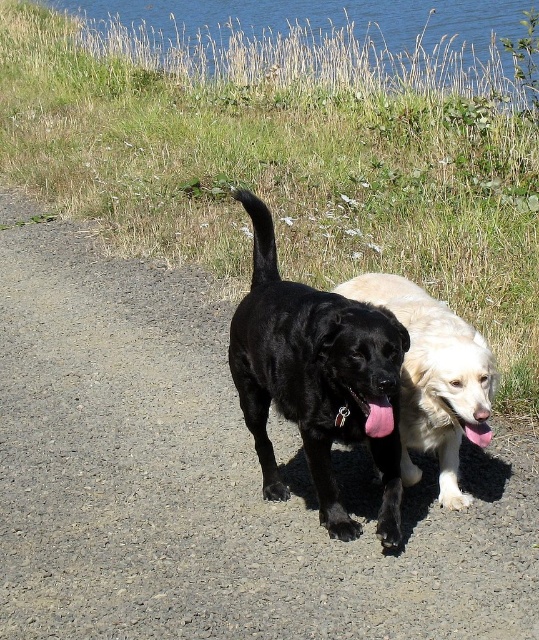
You are a dog owner who wants to ensure your dog can comfortably walk on the gravel path at center while keeping their pink fabric tongue at center moist. Given the size difference between the two, which object would you need to pay more attention to for your dog s comfort?

The gravel path at center is larger in size than the pink fabric tongue at center, so you should pay more attention to the gravel path at center to ensure it is safe and comfortable for your dog to walk on.

You are a photographer trying to capture both the black matte dog at center and the pink fabric tongue at center in a single frame. Since the camera can only focus on one subject at a time, which subject should you choose to ensure the larger one is in focus?

The black matte dog at center is bigger than the pink fabric tongue at center, so you should focus on the black matte dog at center to ensure the larger subject is in focus.

You are a dog owner observing your two dogs on a walk. You notice the gravel path at center and the pink fabric tongue at center. Which object is located below the other?

The gravel path at center is positioned under the pink fabric tongue at center.